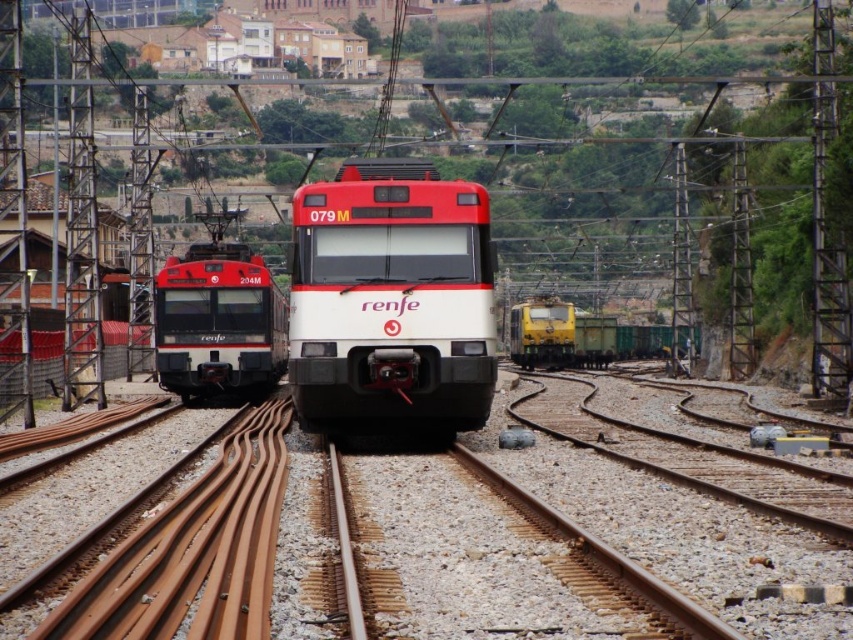
You are a railway inspector checking the track spacing between the white glossy train at center and the yellow matte train at right. The minimum required track spacing for safe operation is 3 meters. Can you confirm if the current spacing meets the safety standard?

The white glossy train at center has a lesser width compared to the yellow matte train at right, but the track spacing requirement is based on the width of the widest train. Since the yellow matte train at right is wider, the track spacing must be at least 3 meters to accommodate its width. Without knowing the exact width of the yellow matte train at right, we cannot confirm if the current spacing meets the safety standard.

Looking at this image, you are a railway engineer inspecting the tracks. You need to determine the relative positions of the white glossy train at center and the matte black train at left. Which train is located to the right of the other?

The white glossy train at center is positioned on the right side of the matte black train at left.